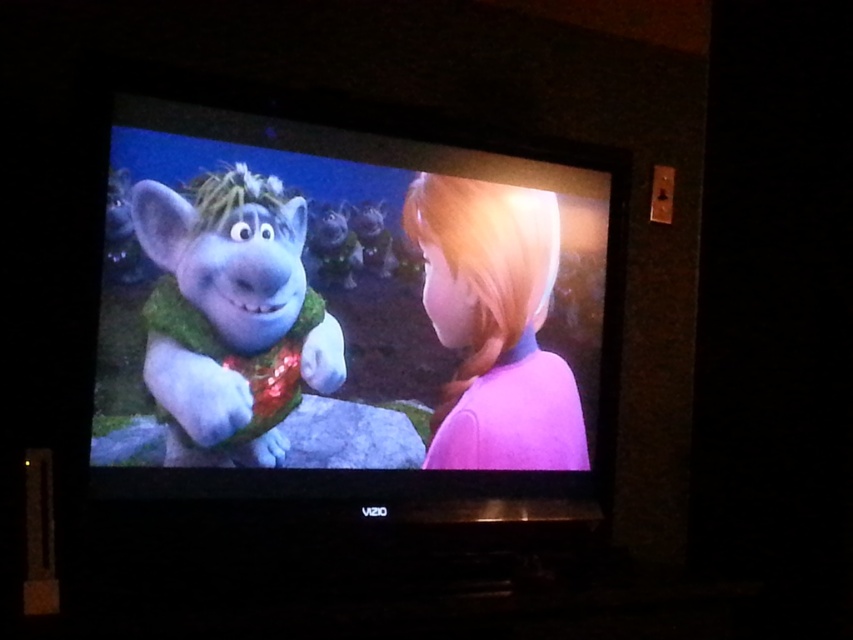
Can you confirm if shiny green fur at center is positioned above blonde hair at right?

Yes.

Who is taller, shiny green fur at center or blonde hair at right?

With more height is shiny green fur at center.

Find the location of a particular element. The height and width of the screenshot is (640, 853). shiny green fur at center is located at coordinates (341, 300).

Who is more distant from viewer, (x=199, y=125) or (x=190, y=362)?

The point (x=199, y=125) is behind.

Is point (335, 436) farther from camera compared to point (236, 260)?

Yes, it is.

Where is `shiny green fur at center`? shiny green fur at center is located at coordinates (341, 300).

Does fluffy green scarf at left have a smaller size compared to blonde hair at right?

Indeed, fluffy green scarf at left has a smaller size compared to blonde hair at right.

Between fluffy green scarf at left and blonde hair at right, which one has more height?

blonde hair at right

Locate an element on the screen. This screenshot has height=640, width=853. fluffy green scarf at left is located at coordinates (230, 316).